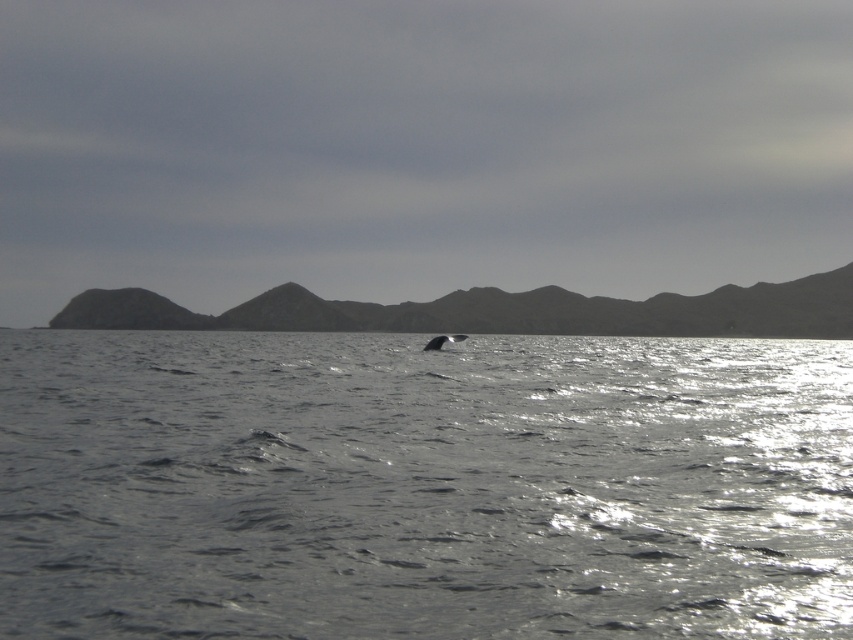
Question: Is glistening silver water at center bigger than gray rocky mountain at center?

Choices:
 (A) yes
 (B) no

Answer: (B)

Question: Can you confirm if glistening silver water at center is wider than gray matte whale at center?

Choices:
 (A) no
 (B) yes

Answer: (B)

Question: Which is farther from the glistening silver water at center?

Choices:
 (A) gray rocky mountain at center
 (B) gray matte whale at center

Answer: (A)

Question: From the image, what is the correct spatial relationship of glistening silver water at center in relation to gray rocky mountain at center?

Choices:
 (A) below
 (B) above

Answer: (A)

Question: Among these points, which one is nearest to the camera?

Choices:
 (A) (210, 316)
 (B) (437, 346)
 (C) (161, 502)

Answer: (C)

Question: Which object appears farthest from the camera in this image?

Choices:
 (A) gray matte whale at center
 (B) glistening silver water at center
 (C) gray rocky mountain at center

Answer: (C)